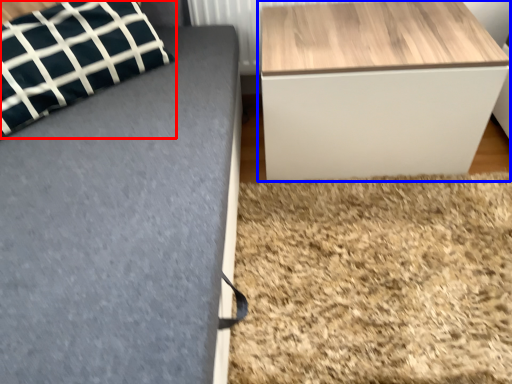
Question: Which point is closer to the camera, pillow (highlighted by a red box) or table (highlighted by a blue box)?

Choices:
 (A) pillow
 (B) table

Answer: (A)